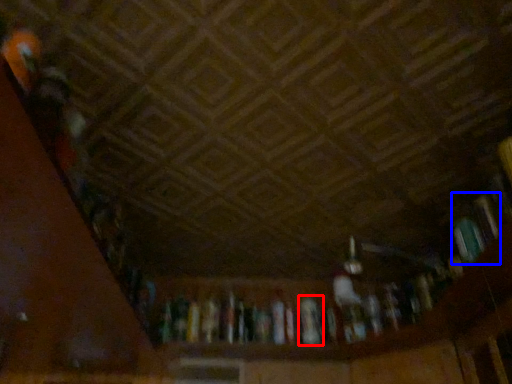
Question: Which object is further to the camera taking this photo, book (highlighted by a red box) or book (highlighted by a blue box)?

Choices:
 (A) book
 (B) book

Answer: (A)